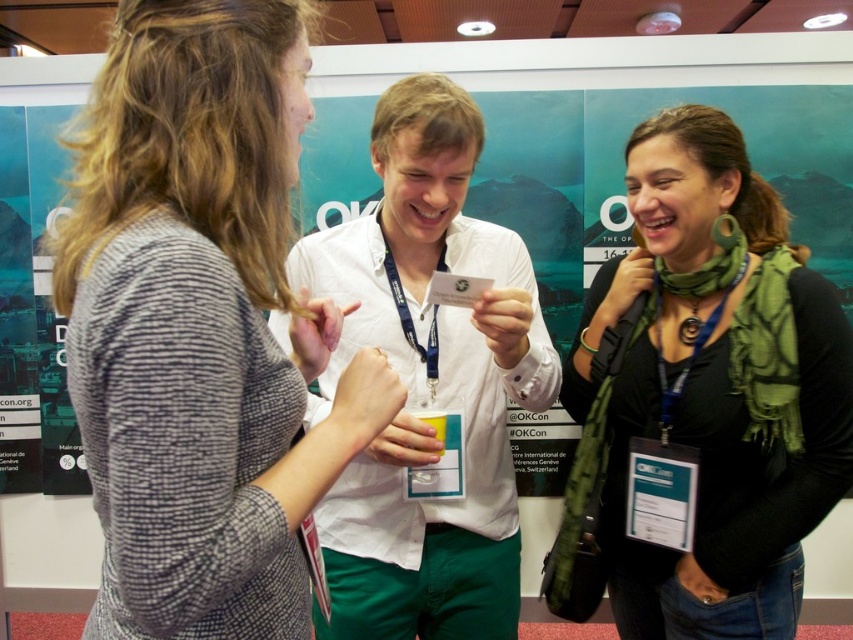
Consider the image. You are standing at the back of the conference room and want to hand a document to the person wearing the knitted gray sweater at left and the green fabric scarf at center. Which one can you reach first if you walk straight forward?

The knitted gray sweater at left is closer to the viewer than the green fabric scarf at center, so you can reach the person wearing the knitted gray sweater at left first by walking straight forward.

You are standing at the origin point in the image. Which of the two points, point (216, 168) or point (625, 388), is closer to you?

Point (216, 168) is in front of point (625, 388), so it is closer to you.